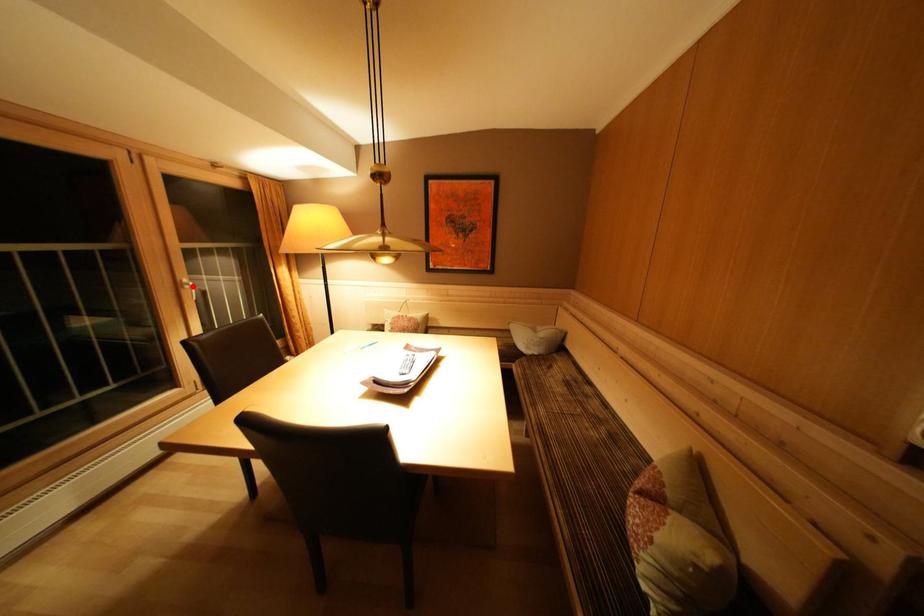
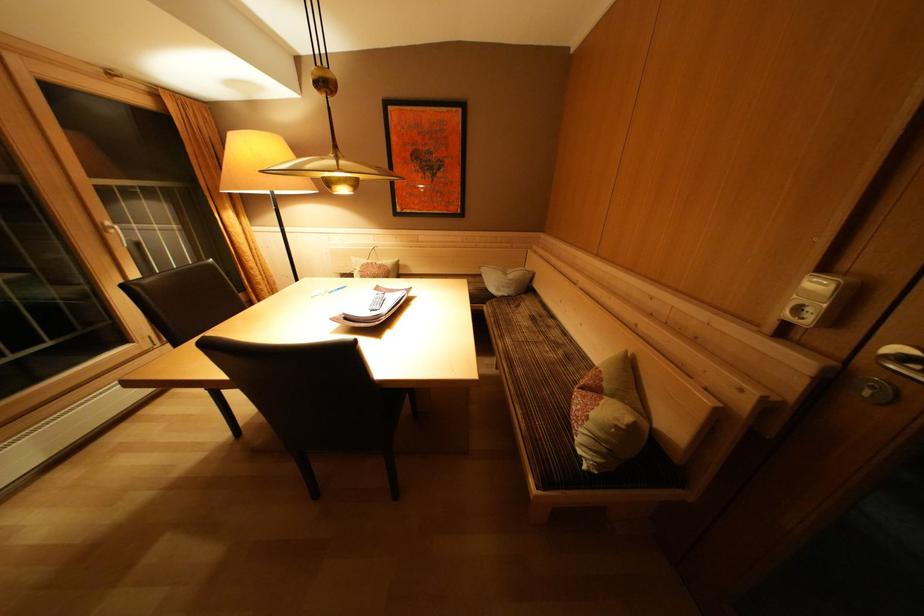
Question: A red point is marked in image1. In image2, is the corresponding 3D point closer to the camera or farther? Reply with the corresponding letter.

Choices:
 (A) The corresponding 3D point is closer.
 (B) The corresponding 3D point is farther.

Answer: (B)